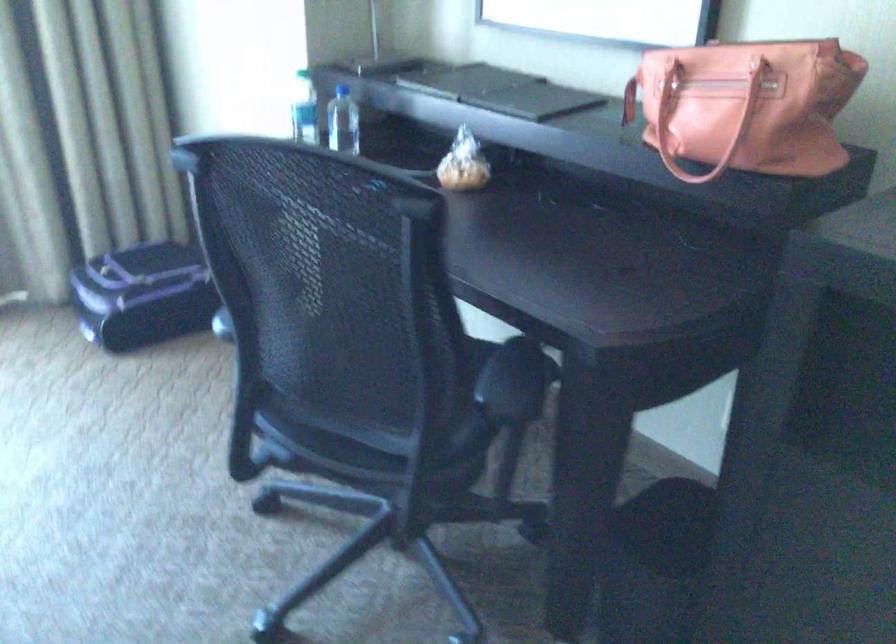
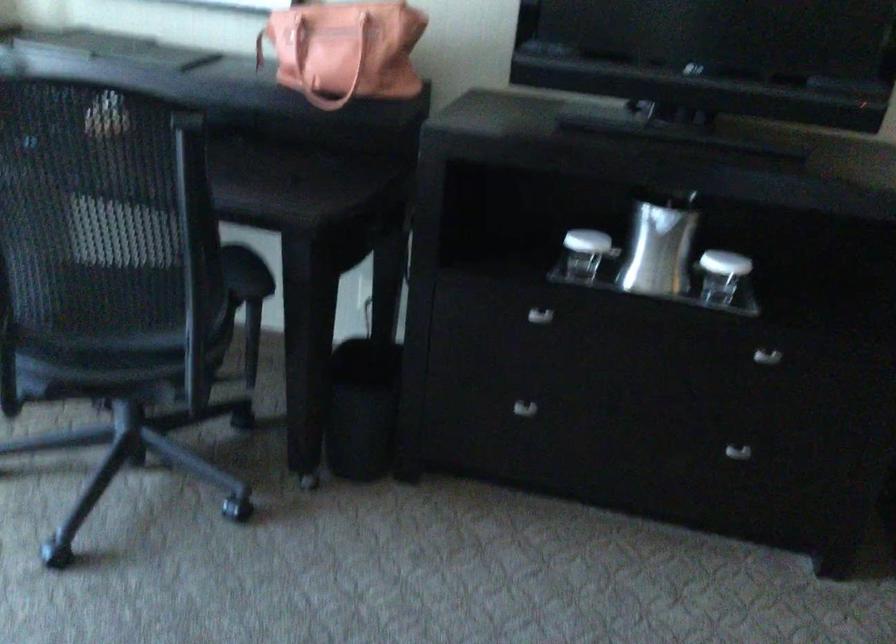
Question: I am providing you with two images of the same scene from different viewpoints. Please identify which objects are invisible in image2.

Choices:
 (A) silver ice bucket
 (B) small wrapped pastry
 (C) dropper bottle cap
 (D) chair sitting surface

Answer: (B)